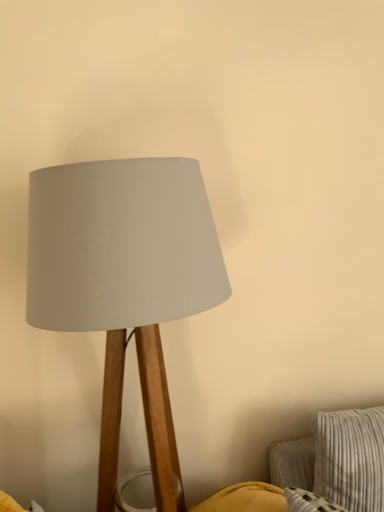
Question: Is striped fabric pillow at lower right oriented towards matte wood lamp at center?

Choices:
 (A) yes
 (B) no

Answer: (B)

Question: Is striped fabric pillow at lower right further to camera compared to matte wood lamp at center?

Choices:
 (A) no
 (B) yes

Answer: (B)

Question: Could matte wood lamp at center be considered to be inside striped fabric pillow at lower right?

Choices:
 (A) no
 (B) yes

Answer: (A)

Question: Is striped fabric pillow at lower right positioned in front of matte wood lamp at center?

Choices:
 (A) no
 (B) yes

Answer: (A)

Question: Does striped fabric pillow at lower right have a lesser height compared to matte wood lamp at center?

Choices:
 (A) no
 (B) yes

Answer: (B)

Question: Is striped fabric pillow at lower right next to matte wood lamp at center?

Choices:
 (A) yes
 (B) no

Answer: (B)

Question: Is matte wood lamp at center taller than striped fabric pillow at lower right?

Choices:
 (A) no
 (B) yes

Answer: (B)

Question: Is the position of matte wood lamp at center more distant than that of striped fabric pillow at lower right?

Choices:
 (A) no
 (B) yes

Answer: (A)

Question: Could you tell me if matte wood lamp at center is turned towards striped fabric pillow at lower right?

Choices:
 (A) no
 (B) yes

Answer: (A)

Question: Is matte wood lamp at center not close to striped fabric pillow at lower right?

Choices:
 (A) yes
 (B) no

Answer: (B)

Question: Can you confirm if matte wood lamp at center is positioned to the right of striped fabric pillow at lower right?

Choices:
 (A) yes
 (B) no

Answer: (B)

Question: From a real-world perspective, is matte wood lamp at center on striped fabric pillow at lower right?

Choices:
 (A) no
 (B) yes

Answer: (B)

Question: From a real-world perspective, is matte wood lamp at center positioned above or below striped fabric pillow at lower right?

Choices:
 (A) above
 (B) below

Answer: (A)